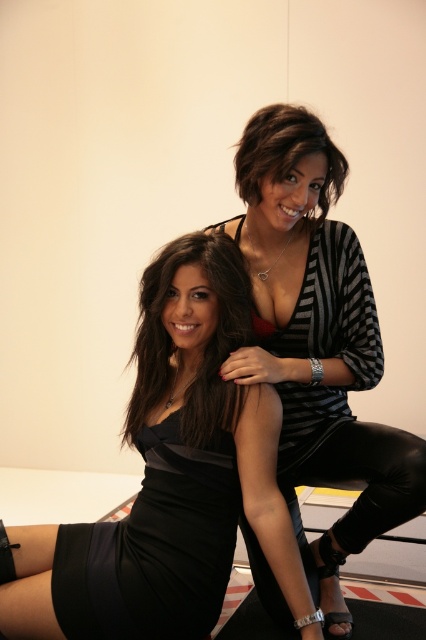
Does striped knit cardigan at center have a lesser width compared to satin black dress at center?

No.

Locate an element on the screen. This screenshot has height=640, width=426. striped knit cardigan at center is located at coordinates (316, 342).

Locate an element on the screen. striped knit cardigan at center is located at coordinates (316, 342).

You are a GUI agent. You are given a task and a screenshot of the screen. Output one action in this format:
    pyautogui.click(x=<x>, y=<y>)
    Task: Click on the black satin dress at center
    This screenshot has height=640, width=426.
    Given the screenshot: What is the action you would take?
    pyautogui.click(x=169, y=480)

Can you confirm if black satin dress at center is positioned to the right of satin black dress at center?

Correct, you'll find black satin dress at center to the right of satin black dress at center.

Image resolution: width=426 pixels, height=640 pixels. In order to click on black satin dress at center in this screenshot , I will do `click(169, 480)`.

Find the location of a particular element. black satin dress at center is located at coordinates coord(169,480).

Can you confirm if striped knit cardigan at center is shorter than shiny black hair at upper center?

No.

Does point (305, 227) lie behind point (264, 160)?

Yes, it is behind point (264, 160).

At what (x,y) coordinates should I click in order to perform the action: click on striped knit cardigan at center. Please return your answer as a coordinate pair (x, y). Looking at the image, I should click on (316, 342).